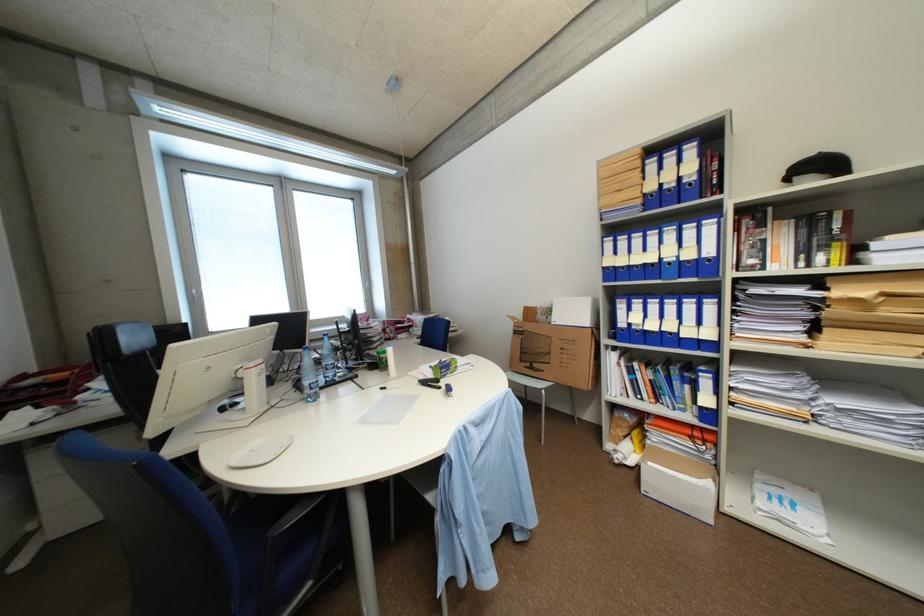
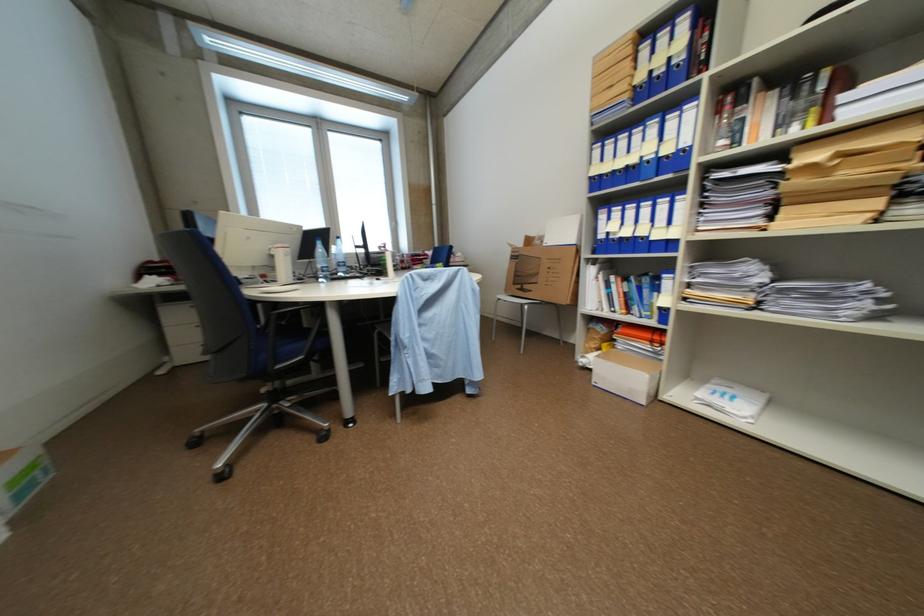
The point at (621,338) is marked in the first image. Where is the corresponding point in the second image?

(602, 253)